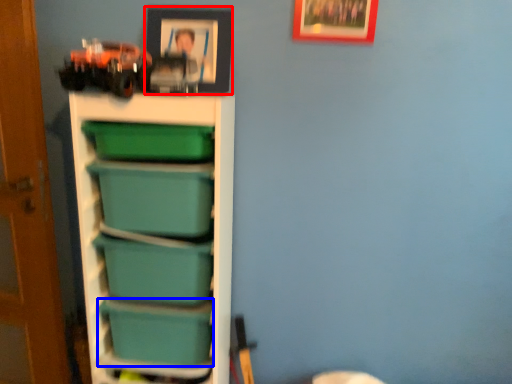
Question: Which of the following is the farthest to the observer, picture frame (highlighted by a red box) or box (highlighted by a blue box)?

Choices:
 (A) picture frame
 (B) box

Answer: (B)